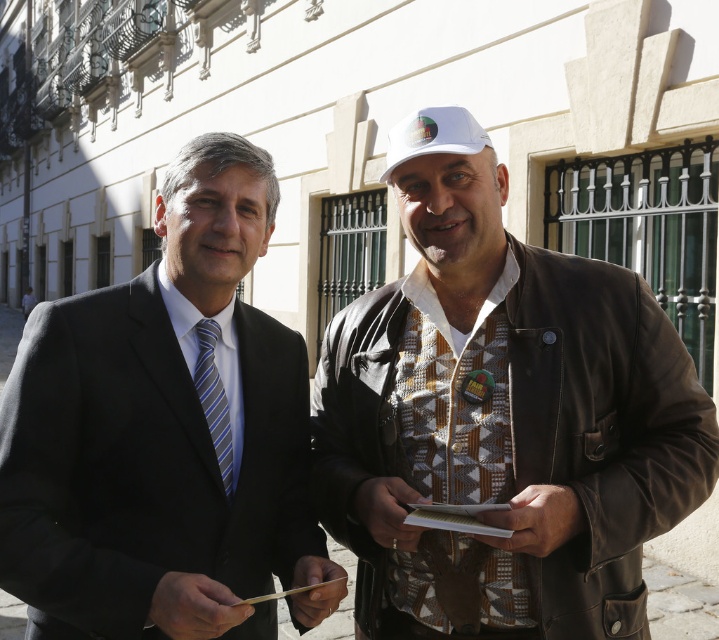
You are a photographer setting up for a group photo. You need to position the brown leather jacket at right and the matte black suit at center so that both are visible in the frame. Based on their current positions, which object is closer to the bottom of the image?

The brown leather jacket at right is located below the matte black suit at center, so it is closer to the bottom of the image.

You are standing in front of the building with the two people. You want to take a photo of the point at coordinates point (467, 141). Your camera can focus on objects within 7 feet. Will the point be in focus?

The distance of point (467, 141) from camera is 7.43 feet, which is slightly beyond the camera focus range of 7 feet. The point may not be in focus.

Looking at this image, you are a photographer trying to capture both the brown leather jacket at right and the blue striped tie at left in a single frame. Since you want to ensure both are clearly visible, which object should you focus on first to account for their sizes?

The brown leather jacket at right is larger than the blue striped tie at left, so you should focus on the brown leather jacket at right first to ensure its details are sharp before adjusting for the smaller blue striped tie at left.